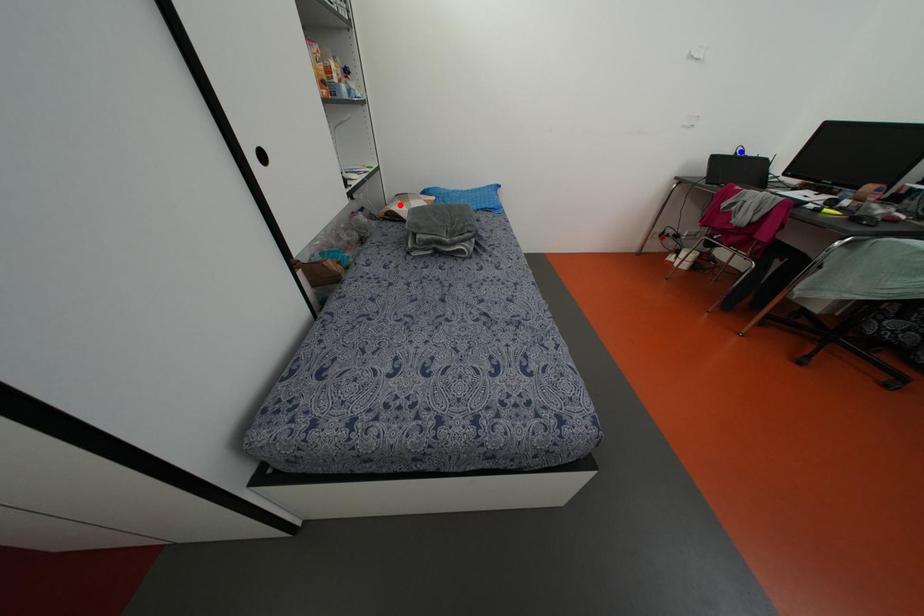
Question: In the image, two points are highlighted. Which point is nearer to the camera? Reply with the corresponding letter.

Choices:
 (A) blue point
 (B) red point

Answer: (B)